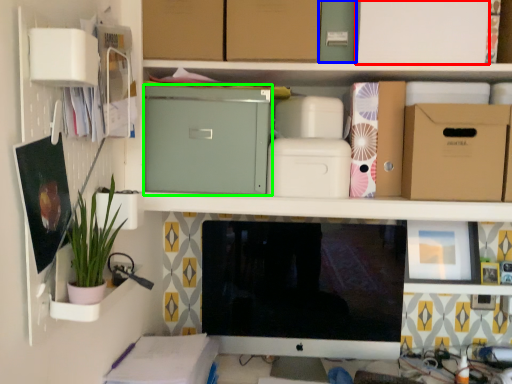
Question: Based on their relative distances, which object is nearer to cardboard box (highlighted by a red box)? Choose from storage box (highlighted by a blue box) and cardboard box (highlighted by a green box).

Choices:
 (A) storage box
 (B) cardboard box

Answer: (A)